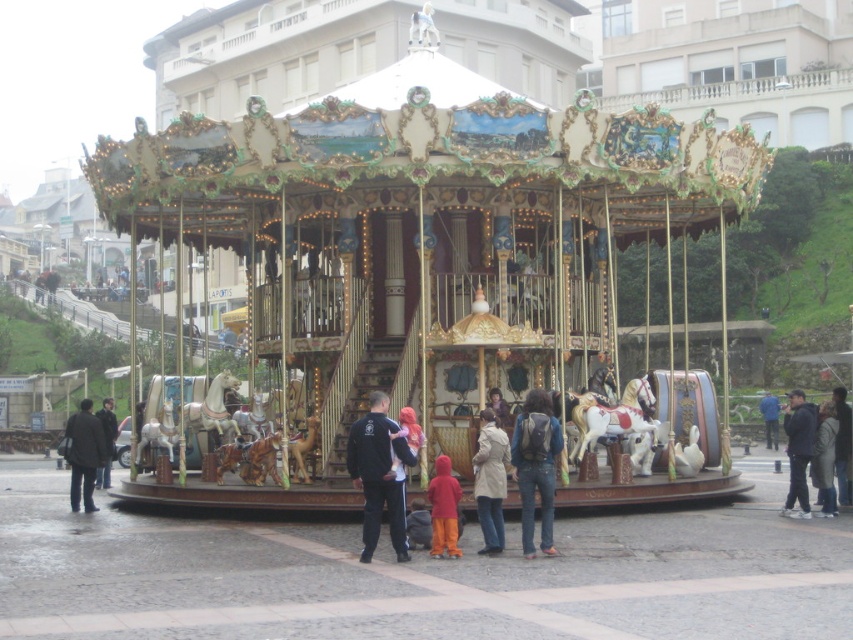
You are standing at the base of the carousel and see the dark blue fabric jacket at center and the dark blue jeans at center. Which one is farther away from you?

The dark blue fabric jacket at center is farther away from you, as it is 75.21 feet away from the dark blue jeans at center, which are closer to your position.